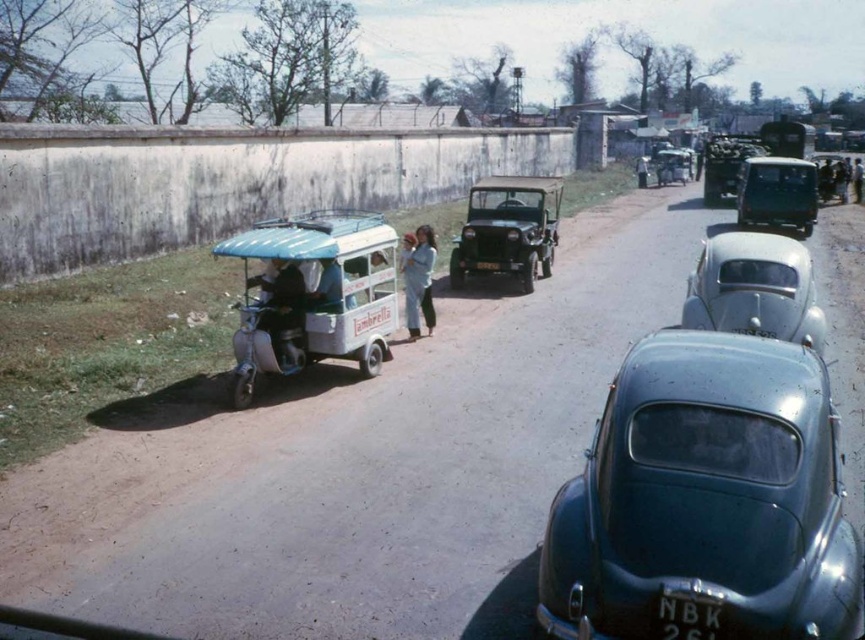
From the picture: Does silver metallic car at center have a lesser width compared to black plastic license plate at lower center?

Incorrect, silver metallic car at center's width is not less than black plastic license plate at lower center's.

Is silver metallic car at center above black plastic license plate at lower center?

Yes, silver metallic car at center is above black plastic license plate at lower center.

Between point (734, 328) and point (716, 620), which one is positioned behind?

Positioned behind is point (734, 328).

This screenshot has width=865, height=640. I want to click on silver metallic car at center, so click(x=754, y=289).

Who is positioned more to the right, dark green matte van at center or black plastic license plate at lower center?

dark green matte van at center is more to the right.

Can you confirm if dark green matte van at center is bigger than black plastic license plate at lower center?

Yes.

Is point (741, 184) less distant than point (687, 611)?

No.

Where is `dark green matte van at center`? Image resolution: width=865 pixels, height=640 pixels. dark green matte van at center is located at coordinates [777, 193].

How far apart are light blue plastic rickshaw at left and silver metallic car at center?

light blue plastic rickshaw at left and silver metallic car at center are 4.77 meters apart from each other.

Can you confirm if light blue plastic rickshaw at left is positioned above silver metallic car at center?

Yes.

The height and width of the screenshot is (640, 865). What do you see at coordinates (312, 294) in the screenshot? I see `light blue plastic rickshaw at left` at bounding box center [312, 294].

Locate an element on the screen. light blue plastic rickshaw at left is located at coordinates (312, 294).